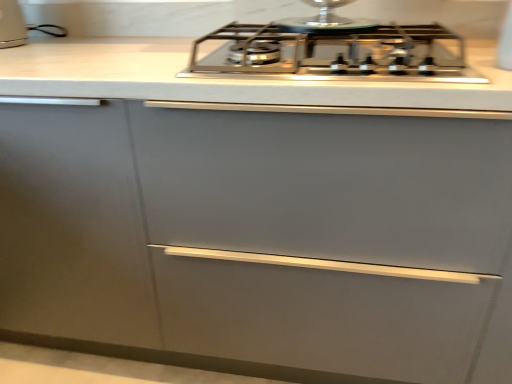
Question: From the image's perspective, would you say white glossy toaster at upper left is positioned over satin silver gas stove at center?

Choices:
 (A) no
 (B) yes

Answer: (B)

Question: Does white glossy toaster at upper left appear on the left side of satin silver gas stove at center?

Choices:
 (A) yes
 (B) no

Answer: (A)

Question: Could you tell me if white glossy toaster at upper left is facing satin silver gas stove at center?

Choices:
 (A) no
 (B) yes

Answer: (A)

Question: Is white glossy toaster at upper left turned away from satin silver gas stove at center?

Choices:
 (A) no
 (B) yes

Answer: (A)

Question: Can you confirm if white glossy toaster at upper left is wider than satin silver gas stove at center?

Choices:
 (A) no
 (B) yes

Answer: (A)

Question: Does white glossy toaster at upper left lie in front of satin silver gas stove at center?

Choices:
 (A) yes
 (B) no

Answer: (B)

Question: Can you confirm if satin silver gas stove at center is bigger than white glossy toaster at upper left?

Choices:
 (A) yes
 (B) no

Answer: (A)

Question: From a real-world perspective, is satin silver gas stove at center positioned under white glossy toaster at upper left based on gravity?

Choices:
 (A) yes
 (B) no

Answer: (A)

Question: Is white glossy toaster at upper left surrounded by satin silver gas stove at center?

Choices:
 (A) yes
 (B) no

Answer: (B)

Question: From the image's perspective, would you say satin silver gas stove at center is shown under white glossy toaster at upper left?

Choices:
 (A) yes
 (B) no

Answer: (A)

Question: Would you say satin silver gas stove at center is a long distance from white glossy toaster at upper left?

Choices:
 (A) no
 (B) yes

Answer: (A)

Question: Is satin silver gas stove at center outside of white glossy toaster at upper left?

Choices:
 (A) no
 (B) yes

Answer: (B)

Question: Looking at the image, does white glossy toaster at upper left seem bigger or smaller compared to satin silver gas stove at center?

Choices:
 (A) big
 (B) small

Answer: (B)